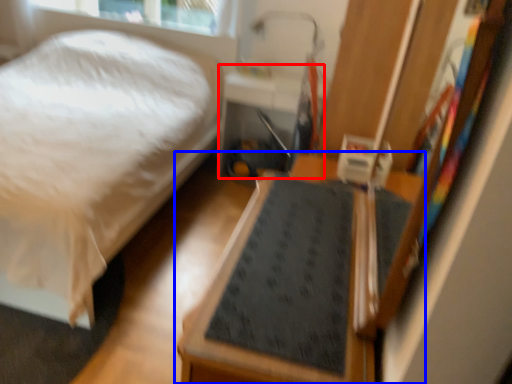
Question: Which object appears farthest to the camera in this image, table (highlighted by a red box) or furniture (highlighted by a blue box)?

Choices:
 (A) table
 (B) furniture

Answer: (A)